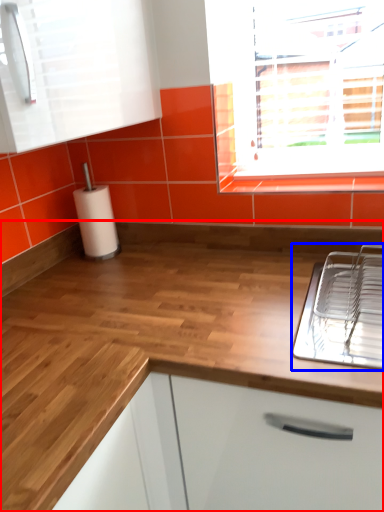
Question: Which of the following is the farthest to the observer, countertop (highlighted by a red box) or appliance (highlighted by a blue box)?

Choices:
 (A) countertop
 (B) appliance

Answer: (B)